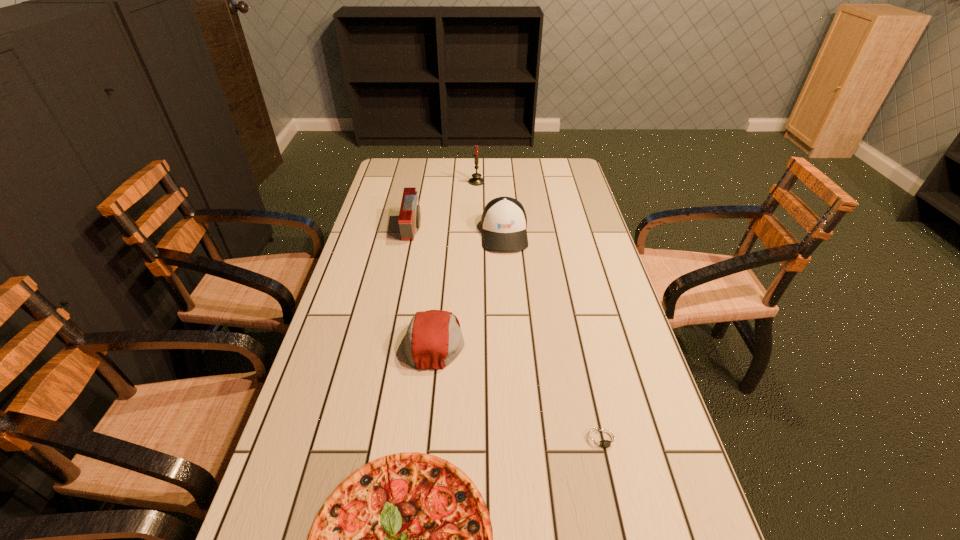
Find the location of a particular element. The height and width of the screenshot is (540, 960). the farthest object is located at coordinates (476, 180).

The height and width of the screenshot is (540, 960). I want to click on the tallest object, so click(476, 180).

You are a GUI agent. You are given a task and a screenshot of the screen. Output one action in this format:
    pyautogui.click(x=<x>, y=<y>)
    Task: Click on the camera
    This screenshot has height=540, width=960.
    Given the screenshot: What is the action you would take?
    pyautogui.click(x=409, y=219)

Where is `the farther cap`? The height and width of the screenshot is (540, 960). the farther cap is located at coordinates (504, 222).

Locate an element on the screen. The width and height of the screenshot is (960, 540). the right cap is located at coordinates (504, 222).

I want to click on the nearer cap, so click(433, 340).

At what (x,y) coordinates should I click in order to perform the action: click on the third nearest object. Please return your answer as a coordinate pair (x, y). The width and height of the screenshot is (960, 540). Looking at the image, I should click on 433,340.

Identify the location of the second shortest object. The width and height of the screenshot is (960, 540). (604, 440).

Identify the location of the rightmost object. (604, 440).

I want to click on free spot located 0.250m on the right of the farthest object, so click(x=546, y=182).